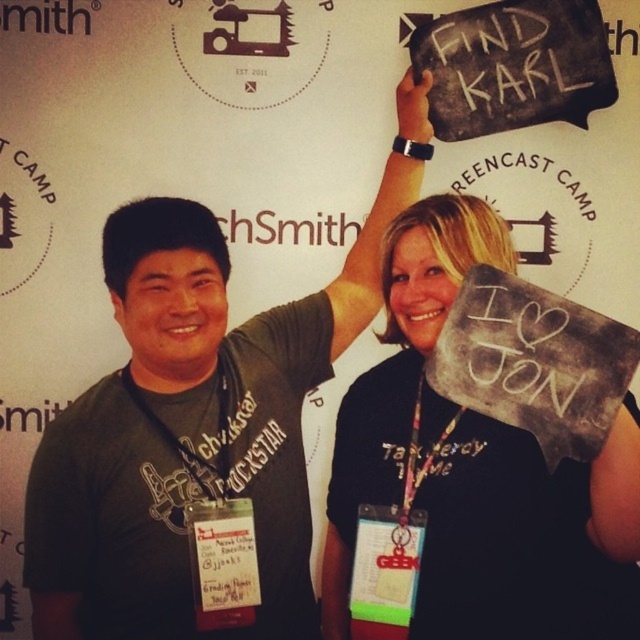
The image size is (640, 640). What are the coordinates of `matte black t-shirt at center` in the screenshot? It's located at (196, 420).

Which is more to the right, matte black t-shirt at center or green plastic badge at lower center?

Positioned to the right is green plastic badge at lower center.

Is point (264, 584) positioned behind point (381, 556)?

Yes, point (264, 584) is behind point (381, 556).

Image resolution: width=640 pixels, height=640 pixels. Find the location of `matte black t-shirt at center`. matte black t-shirt at center is located at coordinates (196, 420).

Which of these two, matte black t-shirt at center or black fabric sign at upper right, stands taller?

With more height is matte black t-shirt at center.

Is point (346, 280) less distant than point (602, 536)?

No, it is not.

At what (x,y) coordinates should I click in order to perform the action: click on matte black t-shirt at center. Please return your answer as a coordinate pair (x, y). This screenshot has height=640, width=640. Looking at the image, I should click on (196, 420).

Can you confirm if white chalkboard at upper center is thinner than green plastic badge at lower center?

No.

Identify the location of white chalkboard at upper center. (532, 362).